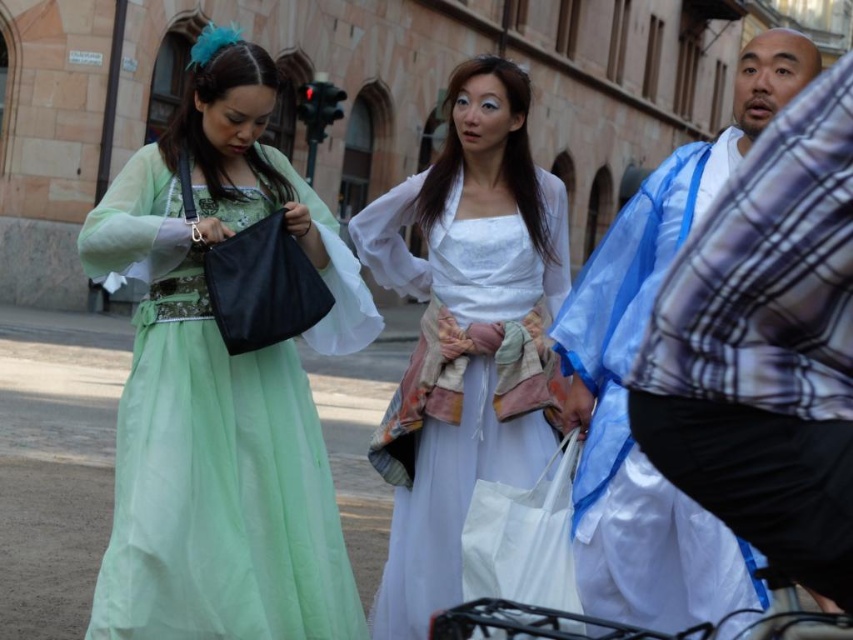
Which is above, matte green dress at center or white sheer dress at center?

matte green dress at center

Locate an element on the screen. This screenshot has height=640, width=853. matte green dress at center is located at coordinates (219, 387).

The height and width of the screenshot is (640, 853). In order to click on matte green dress at center in this screenshot , I will do `click(219, 387)`.

Which is in front, point (511, 163) or point (711, 616)?

Point (711, 616)

Is white sheer dress at center further to camera compared to blue silk kimono at right?

That is True.

I want to click on white sheer dress at center, so pos(465,333).

Does point (251, 470) come behind point (622, 285)?

No, (251, 470) is closer to viewer.

Does matte green dress at center appear over blue silk kimono at right?

Yes.

The height and width of the screenshot is (640, 853). In order to click on matte green dress at center in this screenshot , I will do `click(219, 387)`.

Where is `matte green dress at center`? The height and width of the screenshot is (640, 853). matte green dress at center is located at coordinates (219, 387).